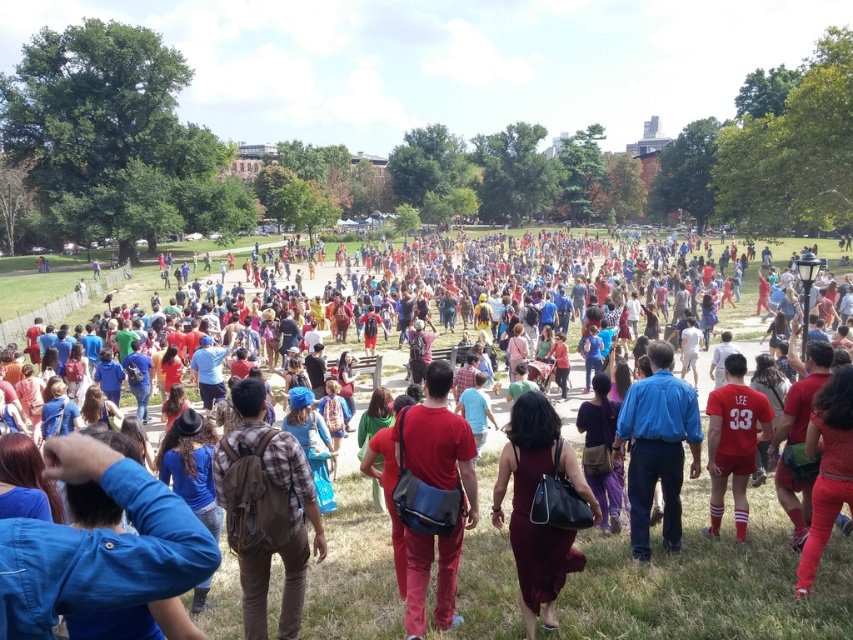
Question: Which object is farther from the camera taking this photo?

Choices:
 (A) blue cotton shirt at center
 (B) matte red shirt at center
 (C) burgundy satin dress at center

Answer: (A)

Question: Is matte red shirt at center to the left of matte red pants at center from the viewer's perspective?

Choices:
 (A) yes
 (B) no

Answer: (B)

Question: Observing the image, what is the correct spatial positioning of matte red pants at center in reference to blue cotton shirt at center?

Choices:
 (A) above
 (B) below

Answer: (B)

Question: Is matte red shirt at center above burgundy satin dress at center?

Choices:
 (A) yes
 (B) no

Answer: (A)

Question: Which object appears farthest from the camera in this image?

Choices:
 (A) blue cotton shirt at center
 (B) matte red pants at center
 (C) matte red shirt at center
 (D) burgundy satin dress at center

Answer: (A)

Question: Which of these objects is positioned closest to the matte red shirt at center?

Choices:
 (A) matte red pants at center
 (B) burgundy satin dress at center
 (C) blue cotton shirt at center

Answer: (C)